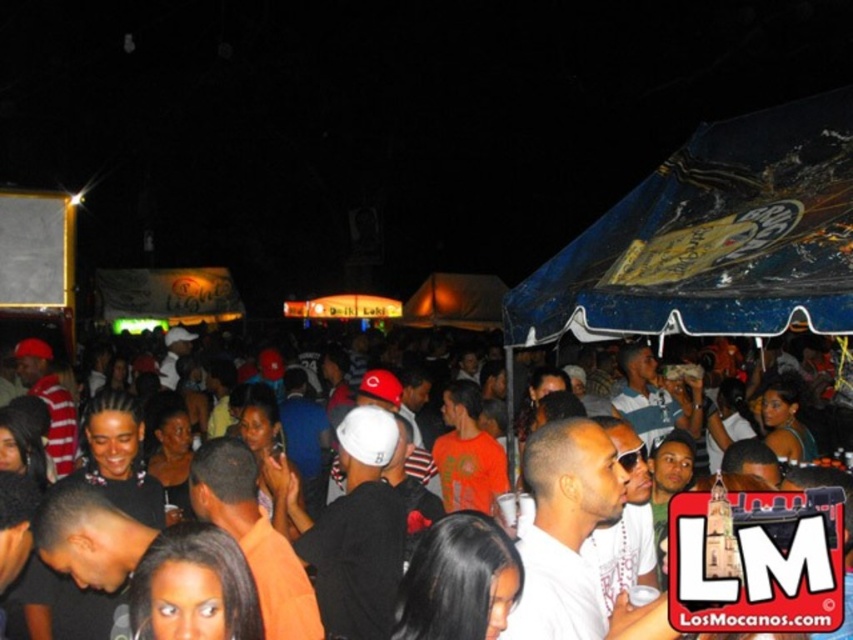
Looking at this image, you are planning to set up a new vendor booth at the festival and need to determine the best location. You have two options near the blue plastic canopy at upper right and the black matte crowd at center. Considering the space available, which location would allow for a wider setup area?

The blue plastic canopy at upper right is thinner than the black matte crowd at center, so the area near the blue plastic canopy at upper right would allow for a wider setup area since it has more space available.

You are standing in the crowd at the nighttime gathering and want to move from your current position to a spot closer to the food stalls. You notice two points marked in the image. Which point, point (834, 216) or point (670, 465), is closer to you and would be a better starting direction to head towards the food stalls?

Point (834, 216) is closer to the viewer than point (670, 465), so heading towards point (834, 216) would be a better starting direction since it is nearer to your current position.